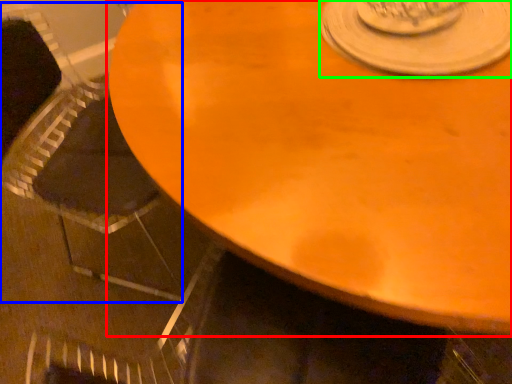
Question: Based on their relative distances, which object is farther from table (highlighted by a red box)? Choose from armchair (highlighted by a blue box) and saucer (highlighted by a green box).

Choices:
 (A) armchair
 (B) saucer

Answer: (A)